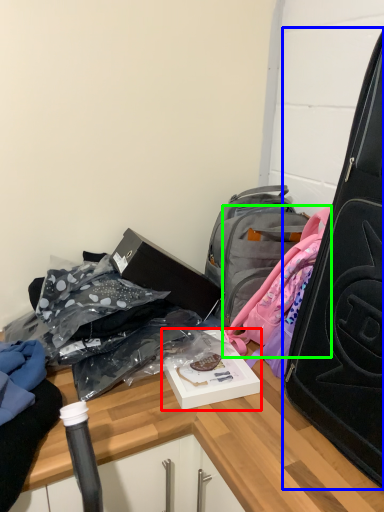
Question: Which object is positioned farthest from kit (highlighted by a red box)? Select from suitcase (highlighted by a blue box) and backpack (highlighted by a green box).

Choices:
 (A) suitcase
 (B) backpack

Answer: (A)